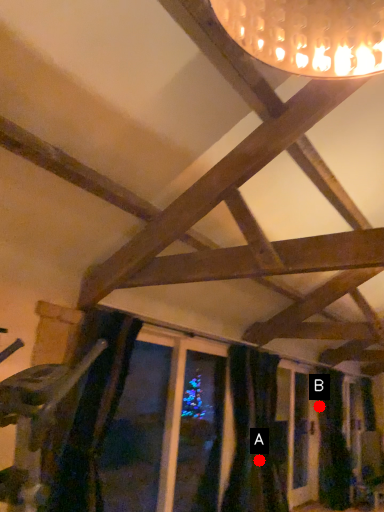
Question: Two points are circled on the image, labeled by A and B beside each circle. Which of the following is the closest to the observer?

Choices:
 (A) A is closer
 (B) B is closer

Answer: (A)